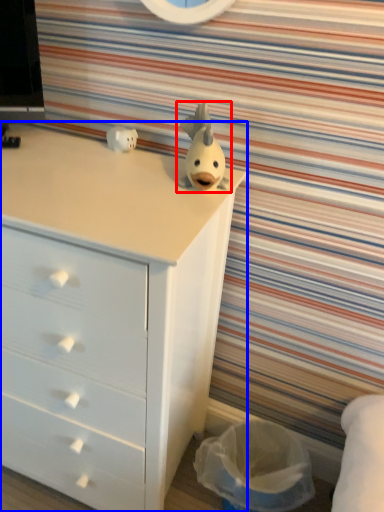
Question: Which object appears closest to the camera in this image, toy (highlighted by a red box) or chest of drawers (highlighted by a blue box)?

Choices:
 (A) toy
 (B) chest of drawers

Answer: (B)